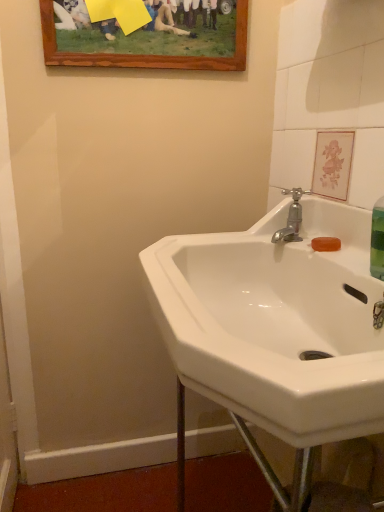
Question: Considering the relative sizes of white glossy sink at center and silver metallic faucet at upper right in the image provided, is white glossy sink at center bigger than silver metallic faucet at upper right?

Choices:
 (A) no
 (B) yes

Answer: (B)

Question: Considering the relative sizes of white glossy sink at center and silver metallic faucet at upper right in the image provided, is white glossy sink at center wider than silver metallic faucet at upper right?

Choices:
 (A) no
 (B) yes

Answer: (B)

Question: Is white glossy sink at center oriented away from silver metallic faucet at upper right?

Choices:
 (A) yes
 (B) no

Answer: (A)

Question: Is silver metallic faucet at upper right located within white glossy sink at center?

Choices:
 (A) yes
 (B) no

Answer: (A)

Question: Is white glossy sink at center not inside silver metallic faucet at upper right?

Choices:
 (A) no
 (B) yes

Answer: (B)

Question: In terms of width, does silver metallic faucet at upper right look wider or thinner when compared to wooden picture frame at upper center?

Choices:
 (A) thin
 (B) wide

Answer: (B)

Question: Is silver metallic faucet at upper right in front of or behind wooden picture frame at upper center in the image?

Choices:
 (A) front
 (B) behind

Answer: (A)

Question: Is silver metallic faucet at upper right inside the boundaries of wooden picture frame at upper center, or outside?

Choices:
 (A) outside
 (B) inside

Answer: (A)

Question: Would you say silver metallic faucet at upper right is to the left or to the right of wooden picture frame at upper center in the picture?

Choices:
 (A) right
 (B) left

Answer: (A)

Question: From the image's perspective, is wooden picture frame at upper center positioned above or below white glossy sink at center?

Choices:
 (A) below
 (B) above

Answer: (B)

Question: Considering the positions of wooden picture frame at upper center and white glossy sink at center in the image, is wooden picture frame at upper center bigger or smaller than white glossy sink at center?

Choices:
 (A) big
 (B) small

Answer: (B)

Question: Is wooden picture frame at upper center taller or shorter than white glossy sink at center?

Choices:
 (A) tall
 (B) short

Answer: (B)

Question: Visually, is wooden picture frame at upper center positioned to the left or to the right of white glossy sink at center?

Choices:
 (A) right
 (B) left

Answer: (B)

Question: Considering the positions of silver metallic faucet at upper right and white glossy sink at center in the image, is silver metallic faucet at upper right bigger or smaller than white glossy sink at center?

Choices:
 (A) big
 (B) small

Answer: (B)

Question: From a real-world perspective, is silver metallic faucet at upper right positioned above or below white glossy sink at center?

Choices:
 (A) above
 (B) below

Answer: (A)